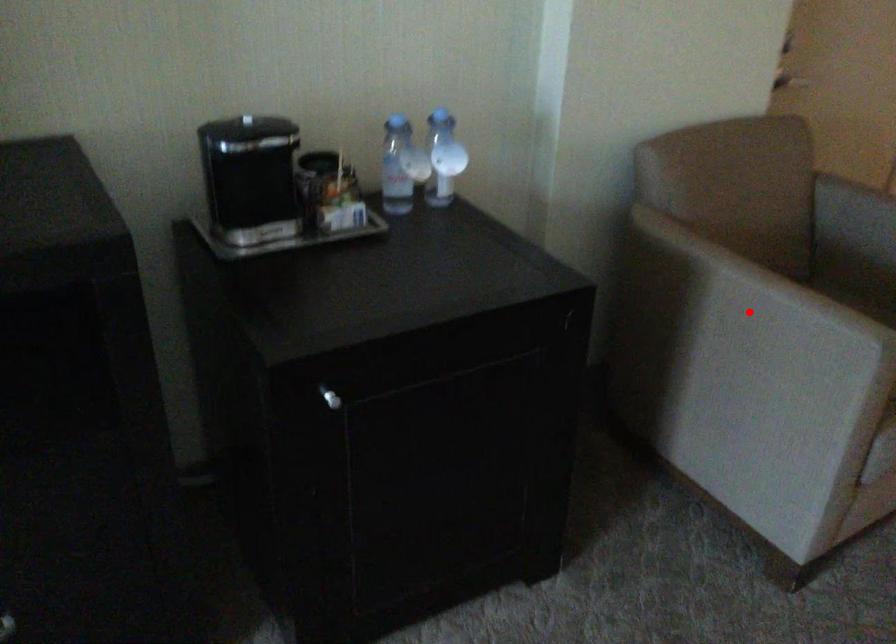
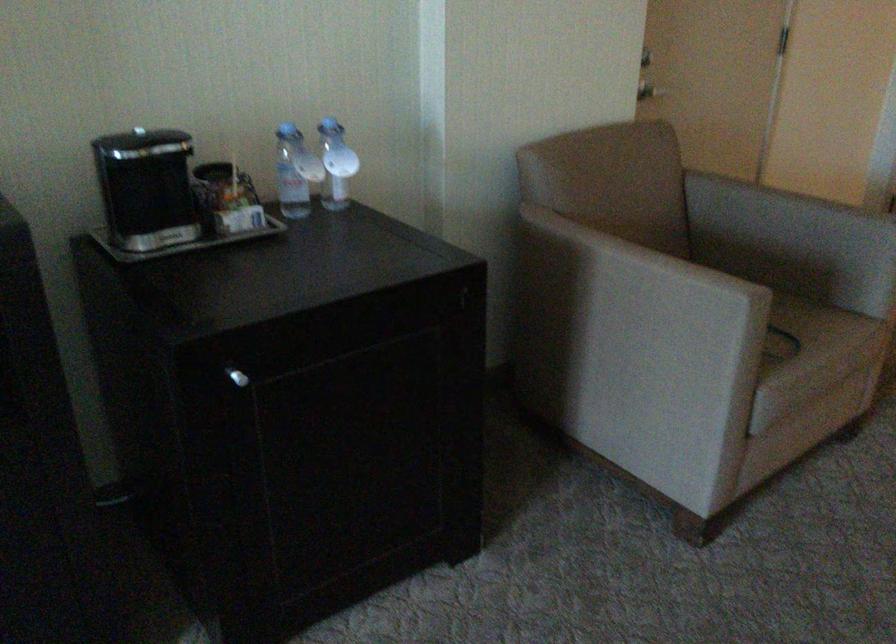
Where in the second image is the point corresponding to the highlighted location from the first image?

(631, 283)